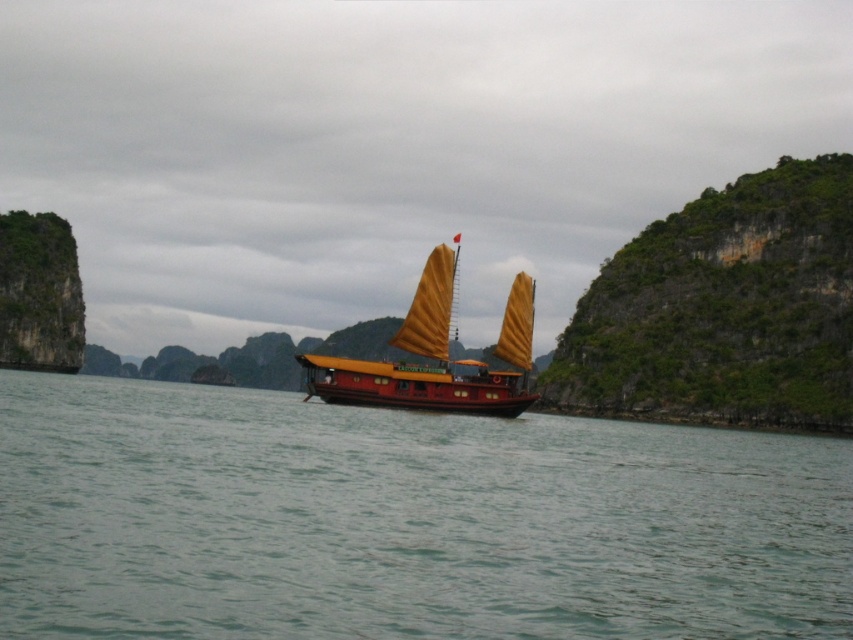
The image size is (853, 640). What are the coordinates of `clear water at center` in the screenshot? It's located at (403, 520).

Consider the image. Does clear water at center appear on the left side of shiny red wood boat at center?

Incorrect, clear water at center is not on the left side of shiny red wood boat at center.

Is point (10, 604) closer to viewer compared to point (521, 353)?

That is True.

I want to click on clear water at center, so click(x=403, y=520).